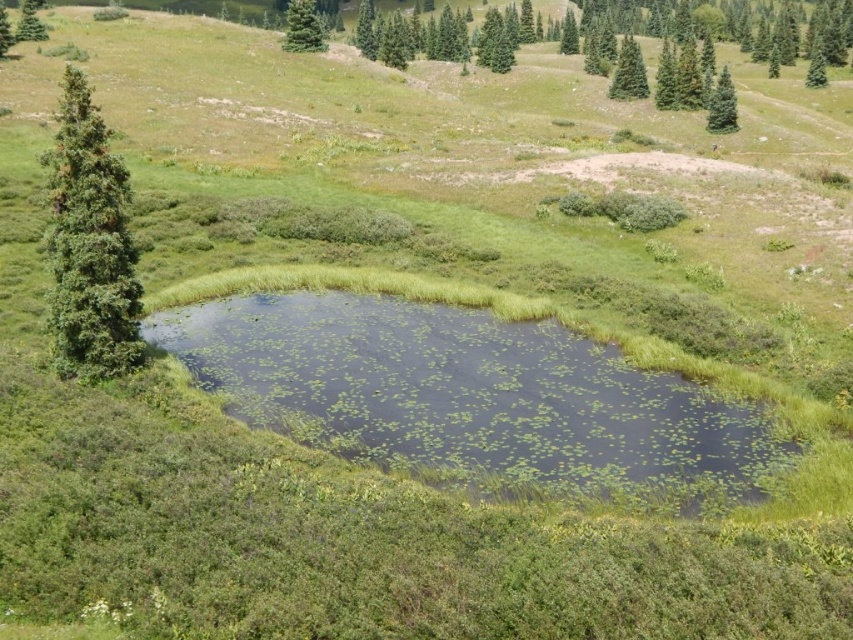
You are a bird flying over the meadow and want to land on a tree. Which tree is closer to you between the green matte evergreen tree at upper center and the green fir tree at upper right?

The green matte evergreen tree at upper center is closer to you because it is in front of the green fir tree at upper right.

You are a bird flying over the pond and want to land on a tree. Which tree, the green matte evergreen tree at upper center or the green fir tree at upper right, is positioned higher in the sky?

The green matte evergreen tree at upper center is positioned higher in the sky than the green fir tree at upper right.

You are standing in the meadow looking at the green grassy lake at center and the green leafy tree at left. Which object is nearer to you?

The green grassy lake at center is closer to the viewer than the green leafy tree at left.